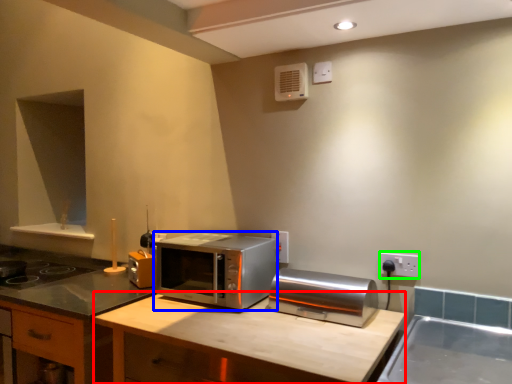
Question: Which is farther away from counter top (highlighted by a red box)? microwave oven (highlighted by a blue box) or electric outlet (highlighted by a green box)?

Choices:
 (A) microwave oven
 (B) electric outlet

Answer: (B)